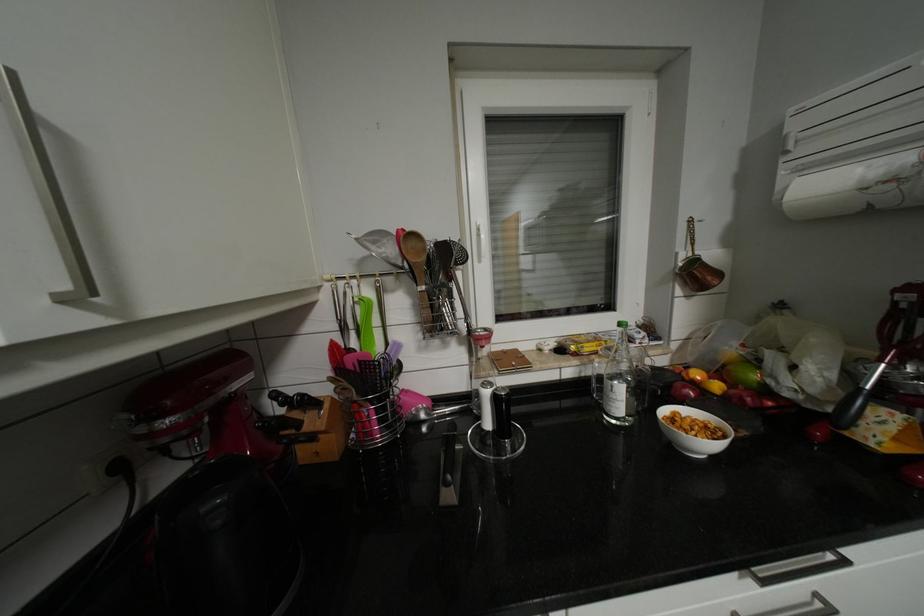
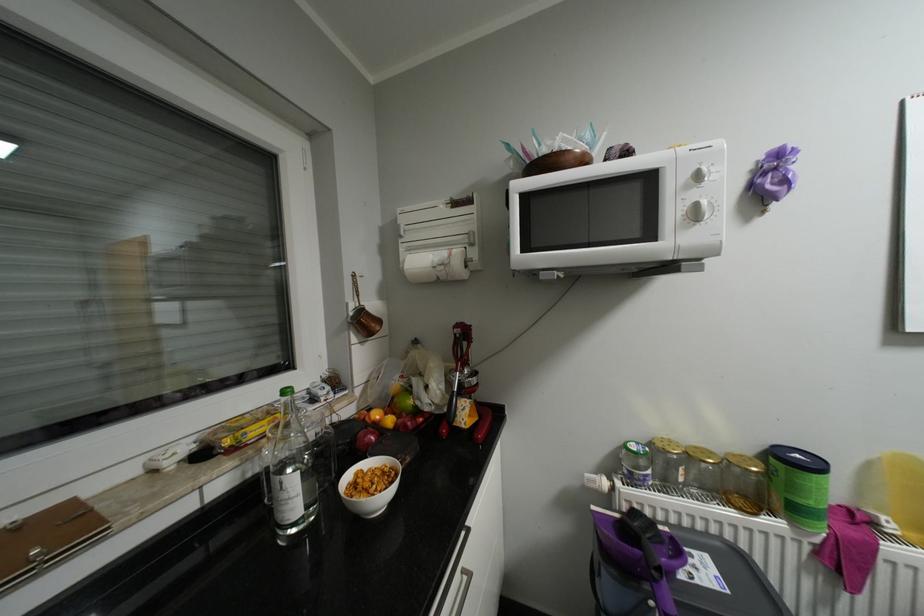
Question: Based on the continuous images, in which direction is the camera rotating? Reply with the corresponding letter.

Choices:
 (A) Left
 (B) Right
 (C) Up
 (D) Down

Answer: (B)